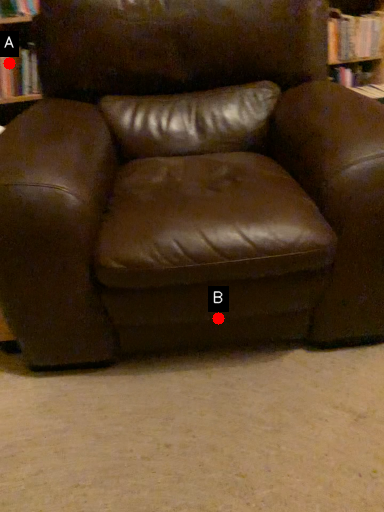
Question: Two points are circled on the image, labeled by A and B beside each circle. Which point appears farthest from the camera in this image?

Choices:
 (A) A is further
 (B) B is further

Answer: (A)